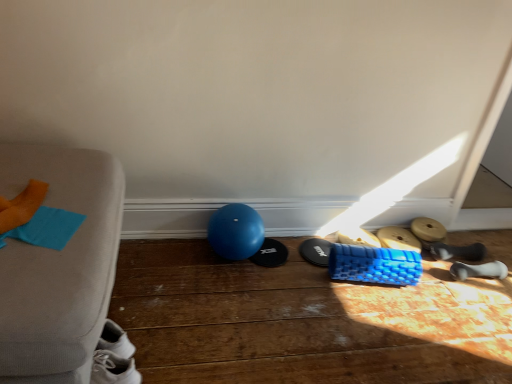
Question: Should I look upward or downward to see blue textured foam roller at lower right, the 4th footwear when ordered from left to right?

Choices:
 (A) up
 (B) down

Answer: (B)

Question: Can you confirm if blue textured foam roller at center, which is the fifth footwear from right to left, is thinner than black rubber shoe at lower right, which appears as the 2th footwear when viewed from the right?

Choices:
 (A) yes
 (B) no

Answer: (B)

Question: Considering the relative sizes of blue textured foam roller at center, which is the fifth footwear from right to left, and black rubber shoe at lower right, the 6th footwear viewed from the left, in the image provided, is blue textured foam roller at center, which is the fifth footwear from right to left, taller than black rubber shoe at lower right, the 6th footwear viewed from the left,?

Choices:
 (A) no
 (B) yes

Answer: (A)

Question: Does blue textured foam roller at center, which is the fifth footwear from right to left, appear on the left side of black rubber shoe at lower right, which appears as the 2th footwear when viewed from the right?

Choices:
 (A) yes
 (B) no

Answer: (A)

Question: From a real-world perspective, is blue textured foam roller at center, which is the third footwear in left-to-right order, below black rubber shoe at lower right, the 6th footwear viewed from the left?

Choices:
 (A) no
 (B) yes

Answer: (A)

Question: Is blue textured foam roller at center, which is the fifth footwear from right to left, beside black rubber shoe at lower right, the 6th footwear viewed from the left?

Choices:
 (A) no
 (B) yes

Answer: (A)

Question: Is blue textured foam roller at center, which is the third footwear in left-to-right order, not near black rubber shoe at lower right, the 6th footwear viewed from the left?

Choices:
 (A) no
 (B) yes

Answer: (A)

Question: From the image's perspective, would you say fabric couch at left is shown under blue textured foam roller at lower right, which is counted as the fourth footwear, starting from the right?

Choices:
 (A) no
 (B) yes

Answer: (B)

Question: Does fabric couch at left have a lesser height compared to blue textured foam roller at lower right, which is counted as the fourth footwear, starting from the right?

Choices:
 (A) yes
 (B) no

Answer: (B)

Question: Can we say fabric couch at left lies outside blue textured foam roller at lower right, which is counted as the fourth footwear, starting from the right?

Choices:
 (A) no
 (B) yes

Answer: (B)

Question: Is fabric couch at left closer to camera compared to blue textured foam roller at lower right, which is counted as the fourth footwear, starting from the right?

Choices:
 (A) no
 (B) yes

Answer: (B)

Question: Can you confirm if fabric couch at left is smaller than blue textured foam roller at lower right, which is counted as the fourth footwear, starting from the right?

Choices:
 (A) yes
 (B) no

Answer: (B)

Question: Is fabric couch at left looking in the opposite direction of blue textured foam roller at lower right, which is counted as the fourth footwear, starting from the right?

Choices:
 (A) yes
 (B) no

Answer: (B)

Question: From a real-world perspective, is blue textured foam roller at lower right, the 4th footwear when ordered from left to right, located beneath black rubber mat at center, the first footwear when ordered from left to right?

Choices:
 (A) yes
 (B) no

Answer: (B)